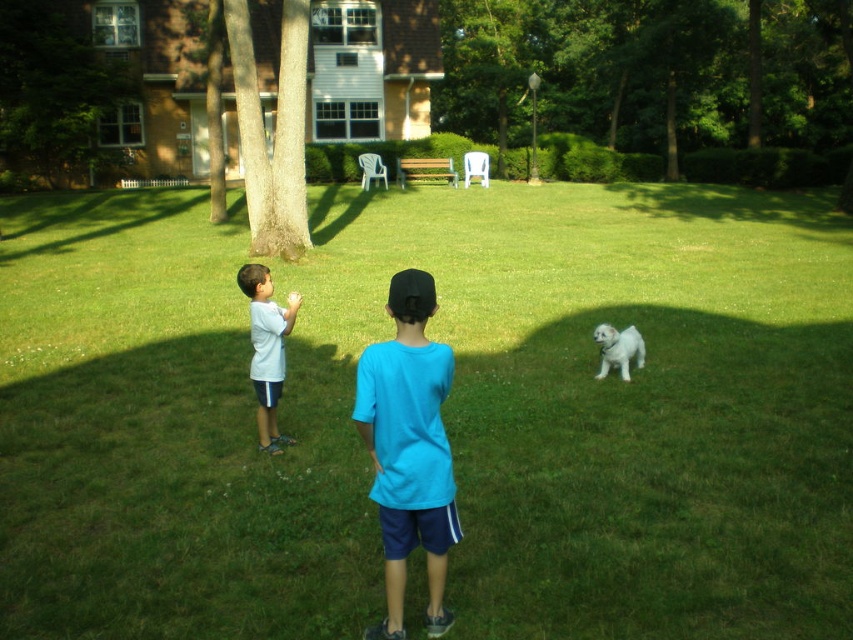
Question: Which point is farther from the camera taking this photo?

Choices:
 (A) (270, 294)
 (B) (792, 413)

Answer: (B)

Question: Which of the following is the closest to the observer?

Choices:
 (A) green grass at center
 (B) blue cotton shirt at center
 (C) white fluffy dog at lower right

Answer: (B)

Question: Where is brown rough bark tree at left located in relation to white matte shirt at left in the image?

Choices:
 (A) above
 (B) below

Answer: (A)

Question: Does white matte shirt at left appear on the left side of white fluffy dog at lower right?

Choices:
 (A) no
 (B) yes

Answer: (B)

Question: Which point is closer to the camera?

Choices:
 (A) green leafy tree at upper center
 (B) white fluffy dog at lower right
 (C) blue cotton shirt at center

Answer: (C)

Question: Can you confirm if white matte shirt at left is wider than white fluffy dog at lower right?

Choices:
 (A) no
 (B) yes

Answer: (A)